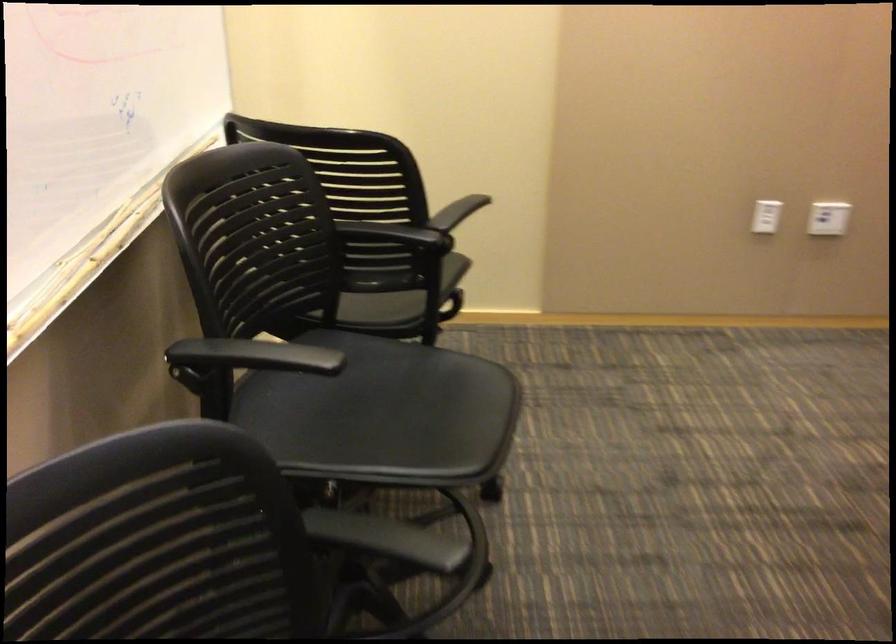
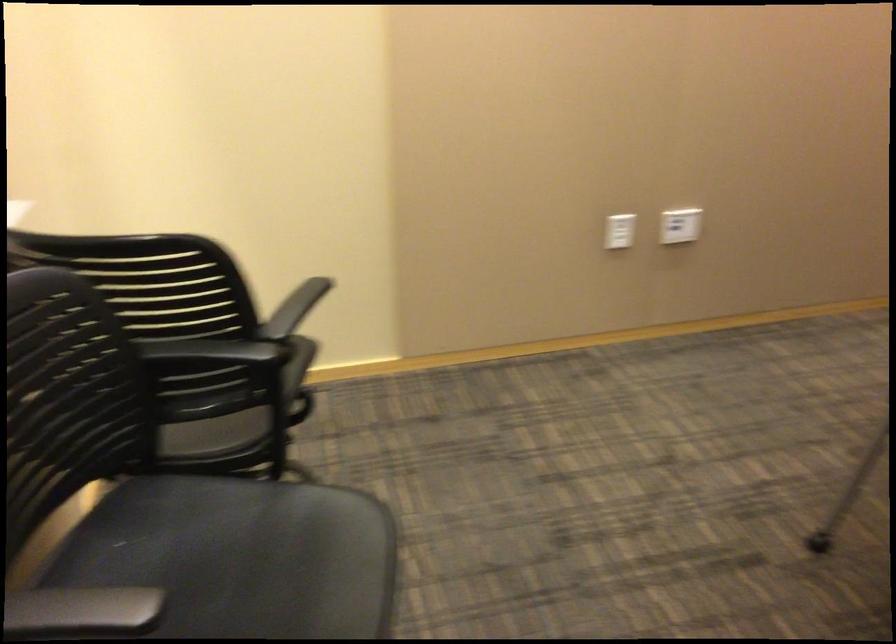
Question: Based on the continuous images, in which direction is the camera rotating? Reply with the corresponding letter.

Choices:
 (A) Left
 (B) Right
 (C) Up
 (D) Down

Answer: (B)